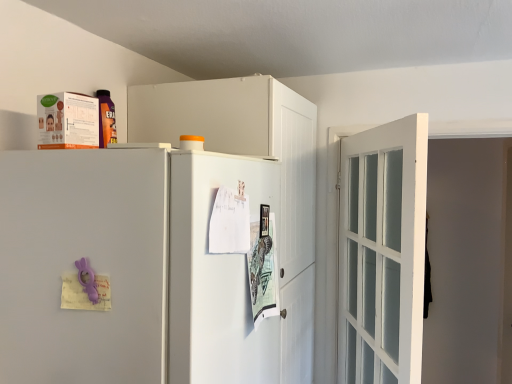
Question: Does white glass door at right come in front of white matte cabinet at upper center?

Choices:
 (A) yes
 (B) no

Answer: (A)

Question: Is white glass door at right far from white matte cabinet at upper center?

Choices:
 (A) no
 (B) yes

Answer: (A)

Question: From the image's perspective, is white glass door at right below white matte cabinet at upper center?

Choices:
 (A) yes
 (B) no

Answer: (A)

Question: From the image's perspective, is white glass door at right located above white matte cabinet at upper center?

Choices:
 (A) yes
 (B) no

Answer: (B)

Question: Is white matte cabinet at upper center at the back of white glass door at right?

Choices:
 (A) no
 (B) yes

Answer: (B)

Question: Considering the positions of white glass door at right and white glossy screen door at center in the image, is white glass door at right taller or shorter than white glossy screen door at center?

Choices:
 (A) tall
 (B) short

Answer: (A)

Question: Relative to white glossy screen door at center, is white glass door at right in front or behind?

Choices:
 (A) front
 (B) behind

Answer: (B)

Question: In terms of width, does white glass door at right look wider or thinner when compared to white glossy screen door at center?

Choices:
 (A) wide
 (B) thin

Answer: (A)

Question: Is white glass door at right spatially inside white glossy screen door at center, or outside of it?

Choices:
 (A) inside
 (B) outside

Answer: (B)

Question: From a real-world perspective, is white matte refrigerator at center positioned above or below white matte cabinet at upper center?

Choices:
 (A) below
 (B) above

Answer: (A)

Question: Is white matte refrigerator at center to the left or to the right of white matte cabinet at upper center in the image?

Choices:
 (A) right
 (B) left

Answer: (B)

Question: Is white matte refrigerator at center bigger or smaller than white matte cabinet at upper center?

Choices:
 (A) big
 (B) small

Answer: (B)

Question: Is point (49, 377) closer or farther from the camera than point (133, 135)?

Choices:
 (A) farther
 (B) closer

Answer: (B)

Question: From the image's perspective, is white matte cabinet at upper center above or below white matte refrigerator at center?

Choices:
 (A) above
 (B) below

Answer: (A)

Question: Is white matte cabinet at upper center spatially inside white matte refrigerator at center, or outside of it?

Choices:
 (A) inside
 (B) outside

Answer: (B)